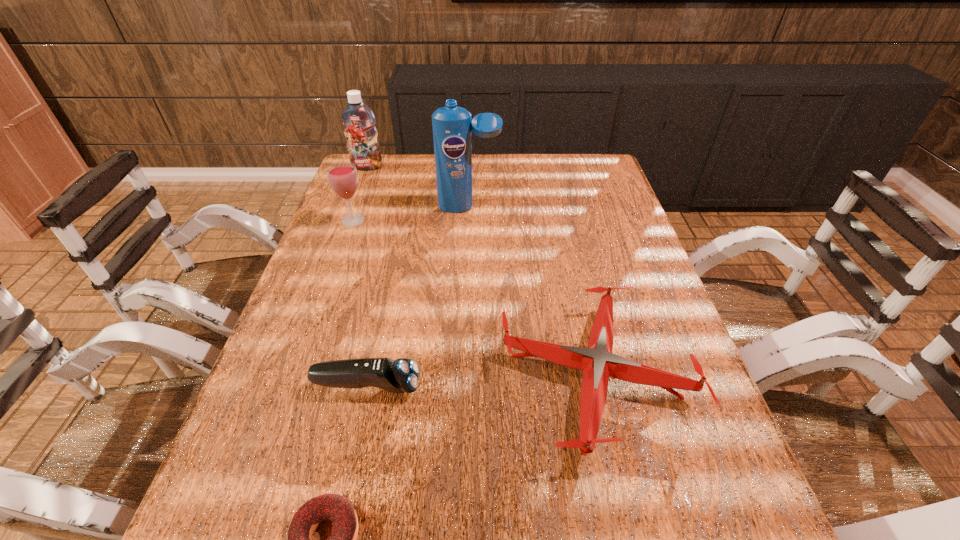
Where is `the right shampoo`? The width and height of the screenshot is (960, 540). the right shampoo is located at coordinates (452, 131).

This screenshot has width=960, height=540. Find the location of `the tallest object`. the tallest object is located at coordinates (452, 131).

Locate an element on the screen. The image size is (960, 540). the left shampoo is located at coordinates (358, 120).

At what (x,y) coordinates should I click in order to perform the action: click on the farther shampoo. Please return your answer as a coordinate pair (x, y). Image resolution: width=960 pixels, height=540 pixels. Looking at the image, I should click on (358, 120).

Image resolution: width=960 pixels, height=540 pixels. What are the coordinates of `wineglass` in the screenshot? It's located at (343, 178).

Find the location of a particular element. This screenshot has height=540, width=960. drone is located at coordinates (598, 363).

Locate an element on the screen. This screenshot has height=540, width=960. electric shaver is located at coordinates click(401, 375).

Where is `free space located on the front of the tallest object`? free space located on the front of the tallest object is located at coordinates (467, 272).

Locate an element on the screen. The height and width of the screenshot is (540, 960). vacant space situated 0.170m on the front label of the fifth shortest object is located at coordinates (355, 198).

You are a GUI agent. You are given a task and a screenshot of the screen. Output one action in this format:
    pyautogui.click(x=<x>, y=<y>)
    Task: Click on the free spot located on the back of the fourth shortest object
    The height and width of the screenshot is (540, 960).
    Given the screenshot: What is the action you would take?
    pyautogui.click(x=359, y=204)